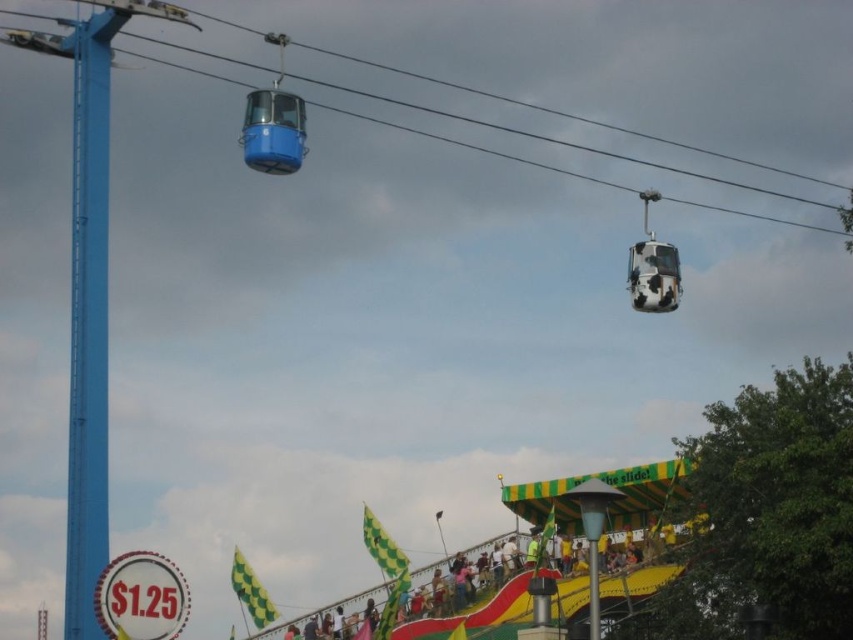
Question: Which of these objects is positioned closest to the cow print fabric at upper center?

Choices:
 (A) blue glossy cable car at upper center
 (B) yellow-green checkered flag at center

Answer: (B)

Question: Which point is farther to the camera?

Choices:
 (A) cow print fabric at upper center
 (B) blue glossy cable car at upper center
 (C) yellow-green checkered flag at center

Answer: (A)

Question: Where is yellow-green checkered flag at center located in relation to blue glossy cable car at upper center in the image?

Choices:
 (A) left
 (B) right

Answer: (B)

Question: In this image, where is yellow-green checkered flag at center located relative to cow print fabric at upper center?

Choices:
 (A) left
 (B) right

Answer: (A)

Question: From the image, what is the correct spatial relationship of yellow-green checkered flag at center in relation to blue glossy cable car at upper center?

Choices:
 (A) above
 (B) below

Answer: (B)

Question: Among these points, which one is nearest to the camera?

Choices:
 (A) (280, 173)
 (B) (662, 580)
 (C) (630, 284)

Answer: (B)